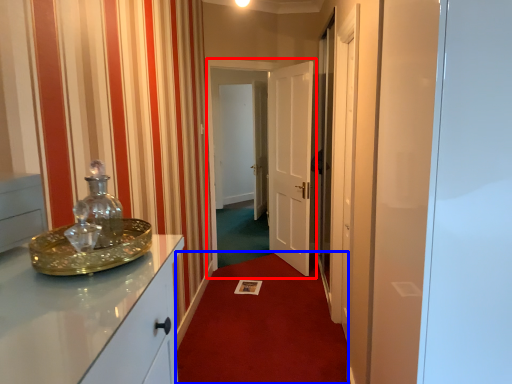
Question: Which point is further to the camera, glass door (highlighted by a red box) or plain (highlighted by a blue box)?

Choices:
 (A) glass door
 (B) plain

Answer: (A)